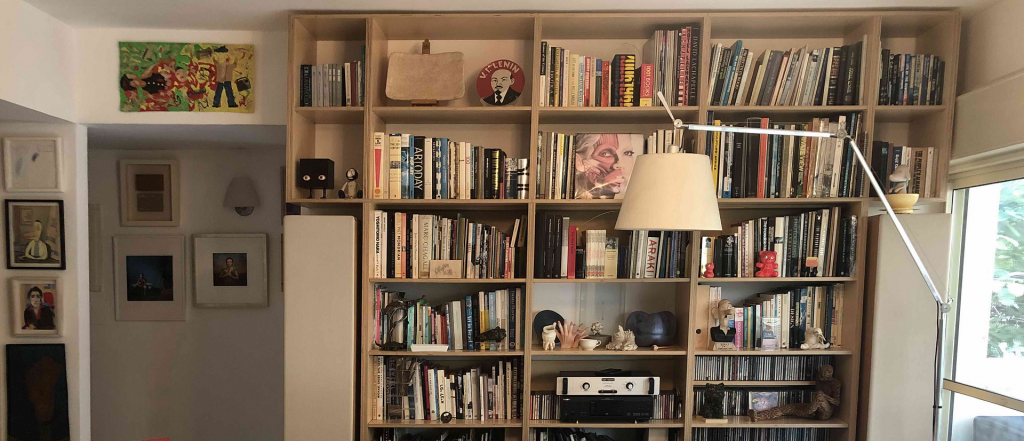
At what (x,y) coordinates should I click in order to perform the action: click on bear figurine. Please return your answer as a coordinate pair (x, y). Image resolution: width=1024 pixels, height=441 pixels. Looking at the image, I should click on (768, 271).